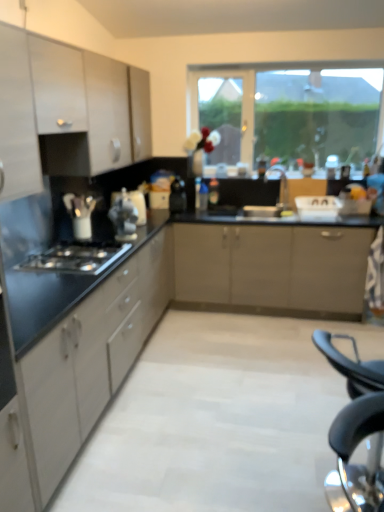
Question: Considering their positions, is matte silver faucet at center located in front of or behind black plastic folding chair at lower right?

Choices:
 (A) behind
 (B) front

Answer: (A)

Question: Is point (284, 173) positioned closer to the camera than point (365, 380)?

Choices:
 (A) closer
 (B) farther

Answer: (B)

Question: Which object is the farthest from the white glossy kettle at left, which appears as the second appliance when viewed from the front?

Choices:
 (A) matte black countertop at left, arranged as the third cabinetry when viewed from the top
 (B) black matte gas stove at lower left
 (C) satin silver kettle at center, which is counted as the 3th appliance, starting from the right
 (D) satin silver cabinet at upper left, the 1th cabinetry viewed from the top
 (E) translucent plastic bottle at center

Answer: (E)

Question: Which of these objects is positioned farthest from the translucent plastic bottle at center?

Choices:
 (A) white glossy kettle at center, acting as the 3th appliance starting from the front
 (B) white glossy kettle at left, which appears as the second appliance when viewed from the front
 (C) black plastic folding chair at lower right
 (D) black matte gas stove at lower left
 (E) matte silver faucet at center

Answer: (C)